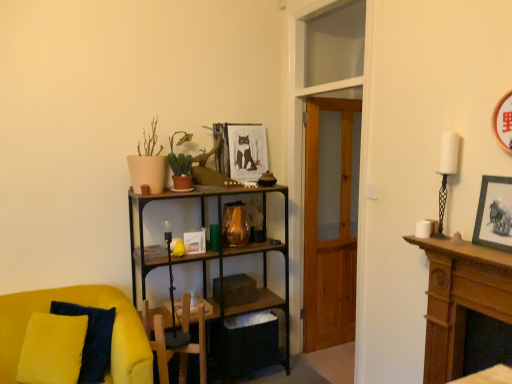
Measure the distance between matte black picture frame at upper right, which ranks as the 1th picture frame in bottom-to-top order, and camera.

The distance of matte black picture frame at upper right, which ranks as the 1th picture frame in bottom-to-top order, from camera is 5.54 feet.

Locate an element on the screen. The height and width of the screenshot is (384, 512). matte black picture frame at upper right, placed as the 2th picture frame when sorted from back to front is located at coordinates (494, 214).

This screenshot has width=512, height=384. Find the location of `green matte cactus at upper center, marked as the 1th houseplant in a back-to-front arrangement`. green matte cactus at upper center, marked as the 1th houseplant in a back-to-front arrangement is located at coordinates (180, 167).

What do you see at coordinates (84, 305) in the screenshot?
I see `velvet yellow armchair at lower left` at bounding box center [84, 305].

The width and height of the screenshot is (512, 384). Describe the element at coordinates (176, 349) in the screenshot. I see `wooden swivel chair at center` at that location.

What are the coordinates of `wooden framed picture at center, positioned as the first picture frame in back-to-front order` in the screenshot? It's located at (241, 150).

What are the coordinates of `matte black picture frame at upper right, the second picture frame in the top-to-bottom sequence` in the screenshot? It's located at (494, 214).

Considering the sizes of objects beige matte pot at upper left, arranged as the 2th houseplant when viewed from the back, and wooden swivel chair at center in the image provided, who is wider, beige matte pot at upper left, arranged as the 2th houseplant when viewed from the back, or wooden swivel chair at center?

beige matte pot at upper left, arranged as the 2th houseplant when viewed from the back, is wider.

Could you tell me if beige matte pot at upper left, arranged as the 2th houseplant when viewed from the back, is turned towards wooden swivel chair at center?

No, beige matte pot at upper left, arranged as the 2th houseplant when viewed from the back, is not turned towards wooden swivel chair at center.

Which is in front, beige matte pot at upper left, placed as the first houseplant when sorted from front to back, or wooden swivel chair at center?

wooden swivel chair at center is closer to the camera.

In terms of width, does velvet yellow armchair at lower left look wider or thinner when compared to beige matte pot at upper left, placed as the first houseplant when sorted from front to back?

Clearly, velvet yellow armchair at lower left has more width compared to beige matte pot at upper left, placed as the first houseplant when sorted from front to back.

Does point (7, 331) come behind point (150, 135)?

That is False.

Between green matte cactus at upper center, marked as the 1th houseplant in a back-to-front arrangement, and matte black picture frame at upper right, the second picture frame in the top-to-bottom sequence, which one is positioned in front?

matte black picture frame at upper right, the second picture frame in the top-to-bottom sequence.

Based on the photo, looking at the image, does green matte cactus at upper center, marked as the 1th houseplant in a back-to-front arrangement, seem bigger or smaller compared to matte black picture frame at upper right, acting as the first picture frame starting from the right?

Considering their sizes, green matte cactus at upper center, marked as the 1th houseplant in a back-to-front arrangement, takes up more space than matte black picture frame at upper right, acting as the first picture frame starting from the right.

How many degrees apart are the facing directions of green matte cactus at upper center, which is counted as the second houseplant, starting from the front, and matte black picture frame at upper right, which appears as the first picture frame when viewed from the front?

The facing directions of green matte cactus at upper center, which is counted as the second houseplant, starting from the front, and matte black picture frame at upper right, which appears as the first picture frame when viewed from the front, are 90.3 degrees apart.

Does green matte cactus at upper center, marked as the 1th houseplant in a back-to-front arrangement, have a greater width compared to matte black picture frame at upper right, placed as the 2th picture frame when sorted from left to right?

Yes, green matte cactus at upper center, marked as the 1th houseplant in a back-to-front arrangement, is wider than matte black picture frame at upper right, placed as the 2th picture frame when sorted from left to right.

Is beige matte pot at upper left, placed as the first houseplant when sorted from front to back, placed right next to matte black picture frame at upper right, placed as the 2th picture frame when sorted from left to right?

No, beige matte pot at upper left, placed as the first houseplant when sorted from front to back, is not touching matte black picture frame at upper right, placed as the 2th picture frame when sorted from left to right.

Is beige matte pot at upper left, placed as the first houseplant when sorted from front to back, outside of matte black picture frame at upper right, acting as the first picture frame starting from the right?

Indeed, beige matte pot at upper left, placed as the first houseplant when sorted from front to back, is completely outside matte black picture frame at upper right, acting as the first picture frame starting from the right.

From a real-world perspective, is beige matte pot at upper left, placed as the first houseplant when sorted from front to back, below matte black picture frame at upper right, acting as the first picture frame starting from the right?

Result: Actually, beige matte pot at upper left, placed as the first houseplant when sorted from front to back, is physically above matte black picture frame at upper right, acting as the first picture frame starting from the right, in the real world.

From a real-world perspective, is wooden framed picture at center, marked as the second picture frame in a right-to-left arrangement, physically below beige matte pot at upper left, arranged as the 2th houseplant when viewed from the back?

Actually, wooden framed picture at center, marked as the second picture frame in a right-to-left arrangement, is physically above beige matte pot at upper left, arranged as the 2th houseplant when viewed from the back, in the real world.

Is wooden framed picture at center, the 1th picture frame when ordered from left to right, inside or outside of beige matte pot at upper left, placed as the first houseplant when sorted from front to back?

wooden framed picture at center, the 1th picture frame when ordered from left to right, is outside beige matte pot at upper left, placed as the first houseplant when sorted from front to back.

Is wooden framed picture at center, positioned as the first picture frame in back-to-front order, further to camera compared to beige matte pot at upper left, placed as the first houseplant when sorted from front to back?

Yes.

Considering the relative sizes of velvet yellow armchair at lower left and wooden framed picture at center, the 2th picture frame from the bottom, in the image provided, is velvet yellow armchair at lower left bigger than wooden framed picture at center, the 2th picture frame from the bottom,?

Indeed, velvet yellow armchair at lower left has a larger size compared to wooden framed picture at center, the 2th picture frame from the bottom.

Could you tell me if velvet yellow armchair at lower left is facing wooden framed picture at center, marked as the second picture frame in a right-to-left arrangement?

No, velvet yellow armchair at lower left is not aimed at wooden framed picture at center, marked as the second picture frame in a right-to-left arrangement.

Considering the sizes of velvet yellow armchair at lower left and wooden framed picture at center, marked as the 2th picture frame in a front-to-back arrangement, in the image, is velvet yellow armchair at lower left taller or shorter than wooden framed picture at center, marked as the 2th picture frame in a front-to-back arrangement,?

In the image, velvet yellow armchair at lower left appears to be taller than wooden framed picture at center, marked as the 2th picture frame in a front-to-back arrangement.

From the image's perspective, is velvet yellow armchair at lower left positioned above or below wooden framed picture at center, the 2th picture frame from the bottom?

velvet yellow armchair at lower left is below wooden framed picture at center, the 2th picture frame from the bottom.

Is matte black picture frame at upper right, placed as the 2th picture frame when sorted from back to front, next to beige matte pot at upper left, arranged as the 2th houseplant when viewed from the back, and touching it?

There is a gap between matte black picture frame at upper right, placed as the 2th picture frame when sorted from back to front, and beige matte pot at upper left, arranged as the 2th houseplant when viewed from the back.

From a real-world perspective, which object rests below the other?

matte black picture frame at upper right, placed as the 2th picture frame when sorted from left to right.

Considering the sizes of objects matte black picture frame at upper right, which appears as the first picture frame when viewed from the front, and beige matte pot at upper left, arranged as the 2th houseplant when viewed from the back, in the image provided, who is shorter, matte black picture frame at upper right, which appears as the first picture frame when viewed from the front, or beige matte pot at upper left, arranged as the 2th houseplant when viewed from the back,?

matte black picture frame at upper right, which appears as the first picture frame when viewed from the front.

Is matte black picture frame at upper right, which ranks as the 1th picture frame in bottom-to-top order, outside of beige matte pot at upper left, arranged as the 2th houseplant when viewed from the back?

Absolutely, matte black picture frame at upper right, which ranks as the 1th picture frame in bottom-to-top order, is external to beige matte pot at upper left, arranged as the 2th houseplant when viewed from the back.

You are a GUI agent. You are given a task and a screenshot of the screen. Output one action in this format:
    pyautogui.click(x=<x>, y=<y>)
    Task: Click on the houseplant that is the 1st object located behind the wooden swivel chair at center
    Image resolution: width=512 pixels, height=384 pixels.
    Given the screenshot: What is the action you would take?
    pyautogui.click(x=147, y=164)

From a real-world perspective, which houseplant is the 2nd one above the velvet yellow armchair at lower left? Please provide its 2D coordinates.

[(147, 164)]

When comparing their distances from green matte cactus at upper center, marked as the 1th houseplant in a back-to-front arrangement, does wooden swivel chair at center or matte black picture frame at upper right, the second picture frame in the top-to-bottom sequence, seem closer?

Based on the image, wooden swivel chair at center appears to be nearer to green matte cactus at upper center, marked as the 1th houseplant in a back-to-front arrangement.

In the scene shown: When comparing their distances from wooden swivel chair at center, does wooden framed picture at center, the 2th picture frame from the bottom, or velvet yellow armchair at lower left seem further?

wooden framed picture at center, the 2th picture frame from the bottom, is positioned further to the anchor wooden swivel chair at center.

Estimate the real-world distances between objects in this image. Which object is closer to matte black picture frame at upper right, placed as the 2th picture frame when sorted from left to right, beige matte pot at upper left, placed as the first houseplant when sorted from front to back, or green matte cactus at upper center, which is counted as the second houseplant, starting from the front?

green matte cactus at upper center, which is counted as the second houseplant, starting from the front.

From the image, which object appears to be farther from wooden swivel chair at center, wooden framed picture at center, the 2th picture frame from the bottom, or matte black picture frame at upper right, acting as the first picture frame starting from the right?

Among the two, matte black picture frame at upper right, acting as the first picture frame starting from the right, is located further to wooden swivel chair at center.

Based on their spatial positions, is wooden framed picture at center, the 1th picture frame when ordered from left to right, or beige matte pot at upper left, arranged as the 2th houseplant when viewed from the back, closer to wooden swivel chair at center?

Among the two, beige matte pot at upper left, arranged as the 2th houseplant when viewed from the back, is located nearer to wooden swivel chair at center.

Which object lies further to the anchor point green matte cactus at upper center, which is counted as the second houseplant, starting from the front, velvet yellow armchair at lower left or matte black picture frame at upper right, placed as the 2th picture frame when sorted from left to right?

matte black picture frame at upper right, placed as the 2th picture frame when sorted from left to right.

Estimate the real-world distances between objects in this image. Which object is closer to velvet yellow armchair at lower left, wooden framed picture at center, marked as the second picture frame in a right-to-left arrangement, or matte black picture frame at upper right, which appears as the first picture frame when viewed from the front?

wooden framed picture at center, marked as the second picture frame in a right-to-left arrangement.

From the image, which object appears to be nearer to wooden swivel chair at center, green matte cactus at upper center, which is counted as the second houseplant, starting from the front, or matte black picture frame at upper right, the second picture frame in the top-to-bottom sequence?

Among the two, green matte cactus at upper center, which is counted as the second houseplant, starting from the front, is located nearer to wooden swivel chair at center.

Where is `houseplant between beige matte pot at upper left, arranged as the 2th houseplant when viewed from the back, and velvet yellow armchair at lower left vertically`? The height and width of the screenshot is (384, 512). houseplant between beige matte pot at upper left, arranged as the 2th houseplant when viewed from the back, and velvet yellow armchair at lower left vertically is located at coordinates (180, 167).

What are the coordinates of `picture frame between green matte cactus at upper center, marked as the 1th houseplant in a back-to-front arrangement, and matte black picture frame at upper right, which appears as the first picture frame when viewed from the front, from left to right` in the screenshot? It's located at (241, 150).

The image size is (512, 384). What are the coordinates of `houseplant between beige matte pot at upper left, placed as the first houseplant when sorted from front to back, and matte black picture frame at upper right, which appears as the first picture frame when viewed from the front` in the screenshot? It's located at (x=180, y=167).

Identify the location of picture frame between wooden swivel chair at center and matte black picture frame at upper right, acting as the first picture frame starting from the right, in the horizontal direction. (241, 150).